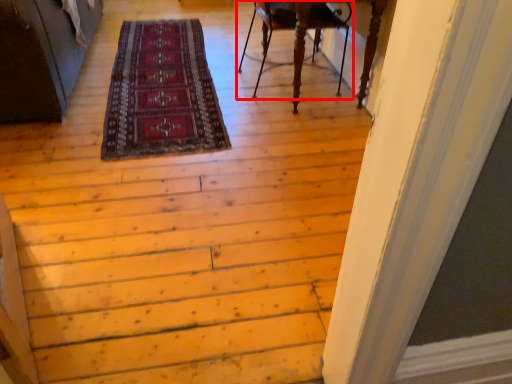
Question: From the image, what is the correct spatial relationship of chair (annotated by the red box) in relation to mat?

Choices:
 (A) right
 (B) left

Answer: (A)